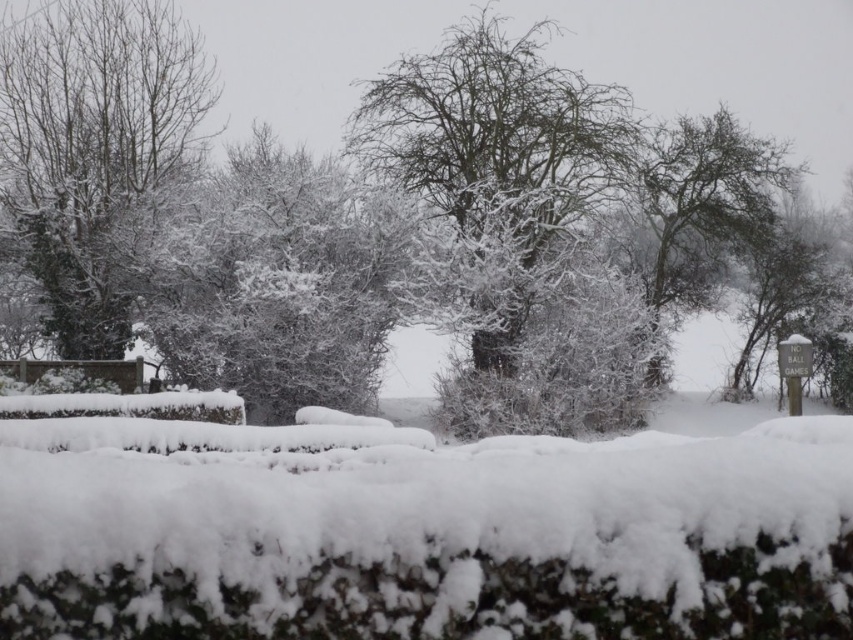
Does white fluffy hedge at center come in front of snow-covered tree at center?

That is True.

Is white fluffy hedge at center thinner than snow-covered tree at center?

Yes, white fluffy hedge at center is thinner than snow-covered tree at center.

Is point (395, 609) in front of point (630, 164)?

Yes, point (395, 609) is in front of point (630, 164).

What are the coordinates of `white fluffy hedge at center` in the screenshot? It's located at (421, 531).

At what (x,y) coordinates should I click in order to perform the action: click on white fluffy hedge at center. Please return your answer as a coordinate pair (x, y). Looking at the image, I should click on (421, 531).

Image resolution: width=853 pixels, height=640 pixels. Find the location of `white fluffy hedge at center`. white fluffy hedge at center is located at coordinates (421, 531).

Identify the location of white fluffy hedge at center. The width and height of the screenshot is (853, 640). (421, 531).

Does snow-covered tree at left have a greater height compared to snow-covered tree at center?

No, snow-covered tree at left is not taller than snow-covered tree at center.

Is the position of snow-covered tree at left more distant than that of snow-covered tree at center?

No, it is in front of snow-covered tree at center.

Is point (45, 33) more distant than point (689, 278)?

No, it is in front of (689, 278).

Locate an element on the screen. This screenshot has width=853, height=640. snow-covered tree at left is located at coordinates (94, 154).